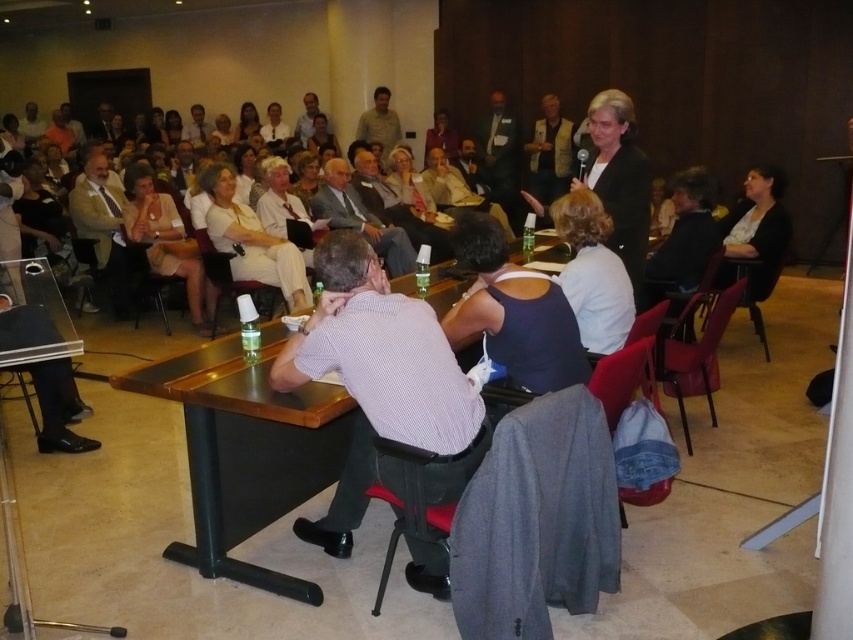
Question: Which point is farther from the camera taking this photo?

Choices:
 (A) (486, 337)
 (B) (221, 164)
 (C) (149, 211)

Answer: (C)

Question: Does wooden table at center have a larger size compared to dark blue tank top at center?

Choices:
 (A) yes
 (B) no

Answer: (A)

Question: Which of the following is the closest to the observer?

Choices:
 (A) wooden table at center
 (B) dark blue tank top at center
 (C) white striped shirt at center

Answer: (A)

Question: Does wooden table at center appear under dark blue tank top at center?

Choices:
 (A) yes
 (B) no

Answer: (A)

Question: Can you confirm if white cotton dress at center is positioned to the right of matte white blouse at center?

Choices:
 (A) yes
 (B) no

Answer: (A)

Question: Which point is closer to the camera?

Choices:
 (A) (192, 308)
 (B) (212, 177)

Answer: (B)